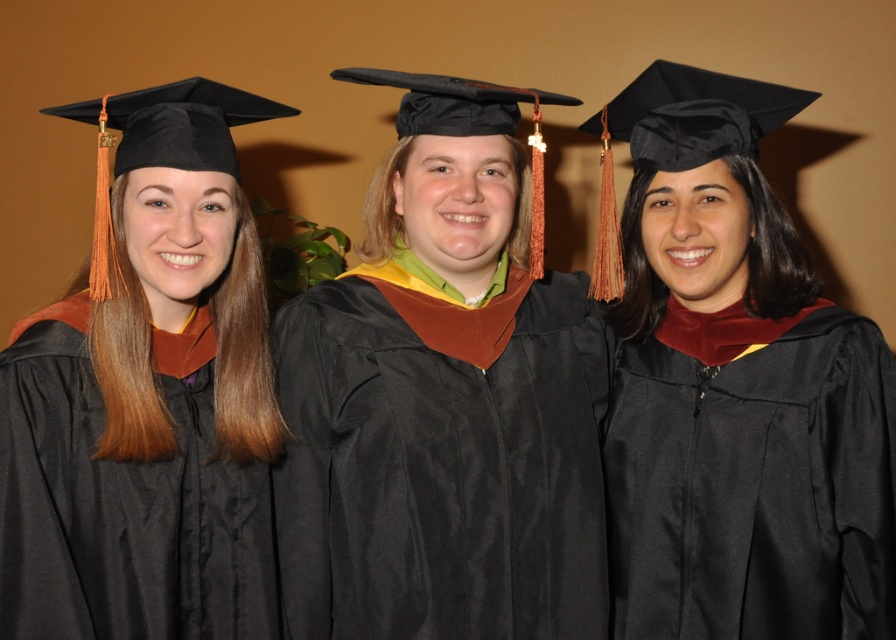
You are standing in front of the three graduates in their graduation gowns and caps. You notice two specific points marked in the scene. The first point is at coordinate point (312, 483) and the second is at point (171, 451). From your perspective, which point is closer to you?

Point (171, 451) is closer to you because, according to the description, point (312, 483) is behind point (171, 451).

You are a photographer taking a graduation photo and need to ensure all gowns are visible. The satin black graduation gown at center and the matte black graduation gown at left are in your frame. Which gown is closer to the camera?

The satin black graduation gown at center is closer to the camera because it is further to the viewer than the matte black graduation gown at left.